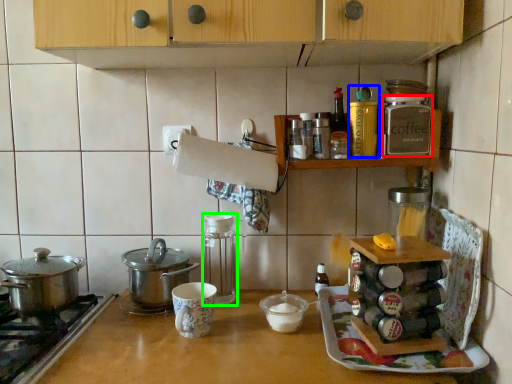
Question: Estimate the real-world distances between objects in this image. Which object is closer to kitchen appliance (highlighted by a red box), kitchen appliance (highlighted by a blue box) or kitchen appliance (highlighted by a green box)?

Choices:
 (A) kitchen appliance
 (B) kitchen appliance

Answer: (A)